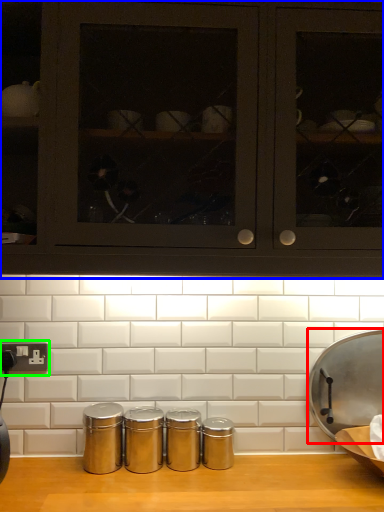
Question: Based on their relative distances, which object is nearer to wide (highlighted by a red box)? Choose from cabinetry (highlighted by a blue box) and electric outlet (highlighted by a green box).

Choices:
 (A) cabinetry
 (B) electric outlet

Answer: (A)